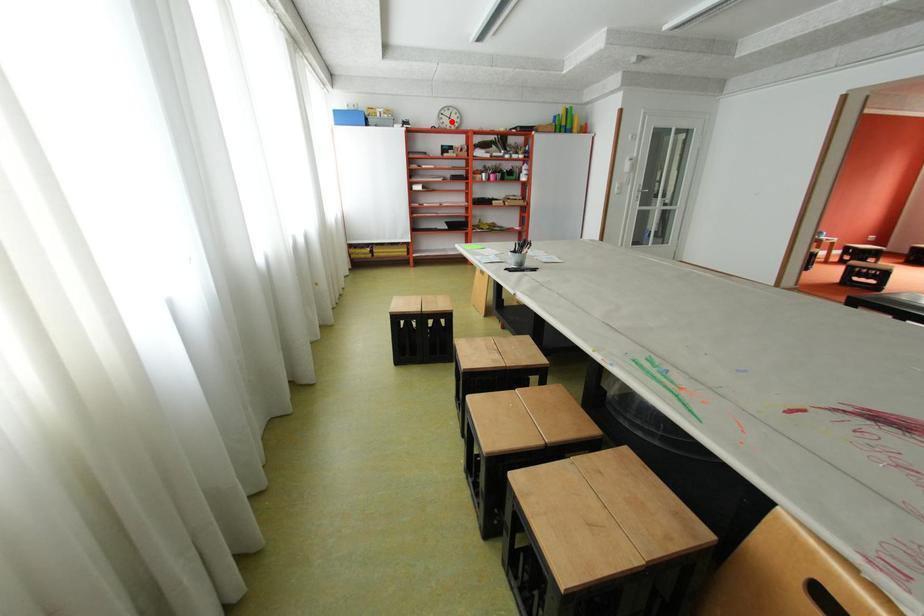
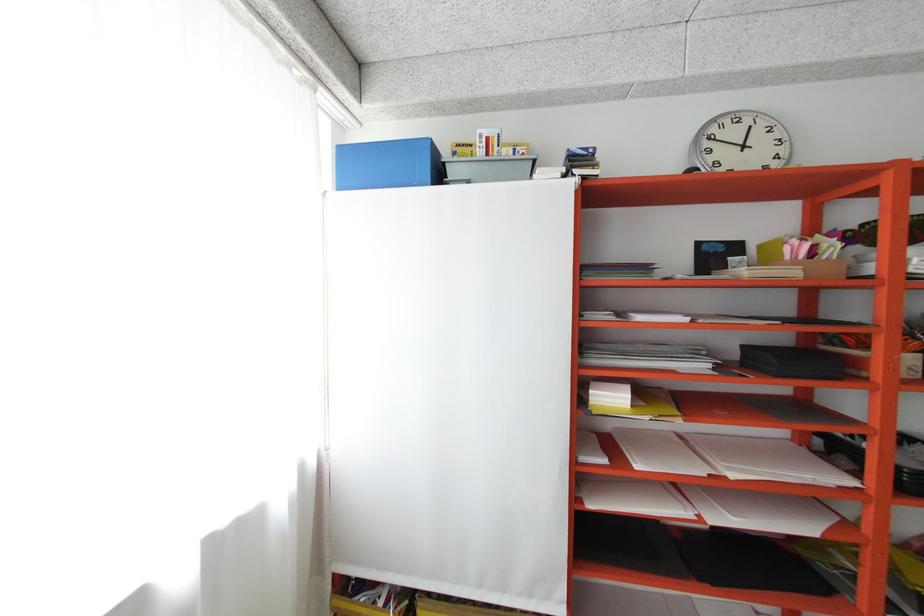
Question: I am providing you with two images of the same scene from different viewpoints. Image1 has a red point marked. In image2, the corresponding 3D location appears at what relative position? Reply with the corresponding letter.

Choices:
 (A) Closer
 (B) Farther

Answer: (B)